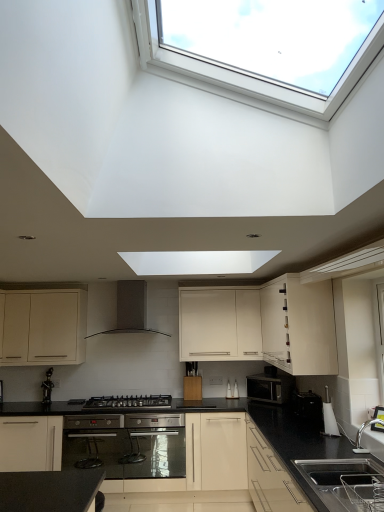
Question: Is black plastic toaster at lower right, the second appliance when ordered from front to back, wider or thinner than matte black microwave at center, the first appliance in the back-to-front sequence?

Choices:
 (A) wide
 (B) thin

Answer: (B)

Question: Is black plastic toaster at lower right, which is counted as the second appliance, starting from the back, in front of or behind matte black microwave at center, the first appliance in the back-to-front sequence, in the image?

Choices:
 (A) behind
 (B) front

Answer: (B)

Question: Considering the real-world distances, which object is closest to the white plastic kettle at lower right, the third appliance viewed from the back?

Choices:
 (A) matte white cabinet at lower left, positioned as the first cabinetry in left-to-right order
 (B) black matte gas stove at center
 (C) black plastic toaster at lower right, which is counted as the second appliance, starting from the back
 (D) black granite sink at lower right
 (E) satin stainless steel oven at center

Answer: (C)

Question: Which object is the closest to the matte black microwave at center, the 3th appliance viewed from the front?

Choices:
 (A) black matte gas stove at center
 (B) white glossy cabinet at upper right, positioned as the first cabinetry in right-to-left order
 (C) black granite sink at lower right
 (D) black matte range hood at center
 (E) matte white cabinet at lower left, which is the third cabinetry from right to left

Answer: (B)